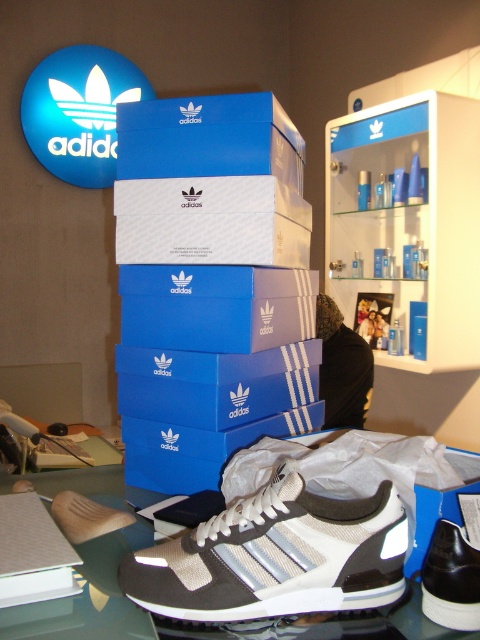
Question: Does blue cardboard box at center come behind white textured sneaker at center?

Choices:
 (A) yes
 (B) no

Answer: (A)

Question: Which point appears closest to the camera in this image?

Choices:
 (A) (360, 588)
 (B) (273, 132)
 (C) (149, 164)

Answer: (A)

Question: Which object is positioned closest to the blue cardboard box at center?

Choices:
 (A) blue matte shoebox at upper center
 (B) white textured sneaker at center
 (C) black leather shoe at lower right

Answer: (A)

Question: Where is blue cardboard box at center located in relation to white textured sneaker at center in the image?

Choices:
 (A) below
 (B) above

Answer: (B)

Question: Estimate the real-world distances between objects in this image. Which object is farther from the blue matte shoebox at upper center?

Choices:
 (A) blue cardboard box at center
 (B) white textured sneaker at center

Answer: (B)

Question: Is blue cardboard box at center above white textured sneaker at center?

Choices:
 (A) no
 (B) yes

Answer: (B)